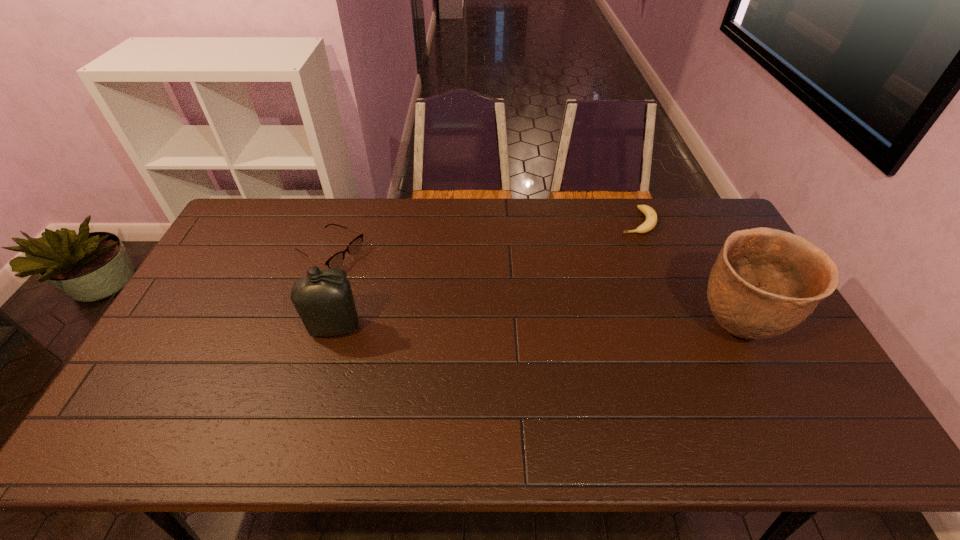
At what (x,y) coordinates should I click in order to perform the action: click on blank space located at the stem of the shortest object. Please return your answer as a coordinate pair (x, y). Looking at the image, I should click on (599, 306).

Image resolution: width=960 pixels, height=540 pixels. What are the coordinates of `vacant point located at the stem of the shortest object` in the screenshot? It's located at (597, 310).

What are the coordinates of `spectacles located at the far edge` in the screenshot? It's located at pos(335,261).

You are a GUI agent. You are given a task and a screenshot of the screen. Output one action in this format:
    pyautogui.click(x=<x>, y=<y>)
    Task: Click on the banana that is at the far edge
    This screenshot has width=960, height=540.
    Given the screenshot: What is the action you would take?
    pyautogui.click(x=651, y=217)

This screenshot has width=960, height=540. I want to click on object that is at the right edge, so click(x=765, y=281).

Locate an element on the screen. This screenshot has height=540, width=960. vacant space at the far edge is located at coordinates (494, 203).

You are a GUI agent. You are given a task and a screenshot of the screen. Output one action in this format:
    pyautogui.click(x=<x>, y=<y>)
    Task: Click on the vacant region at the near edge of the desktop
    This screenshot has width=960, height=540.
    Given the screenshot: What is the action you would take?
    pyautogui.click(x=575, y=386)

Locate an element on the screen. This screenshot has width=960, height=540. vacant space at the left edge of the desktop is located at coordinates (144, 377).

Identify the location of free space at the near left corner of the desktop. The image size is (960, 540). (178, 406).

Identify the location of vacant space at the far right corner. The width and height of the screenshot is (960, 540). (684, 227).